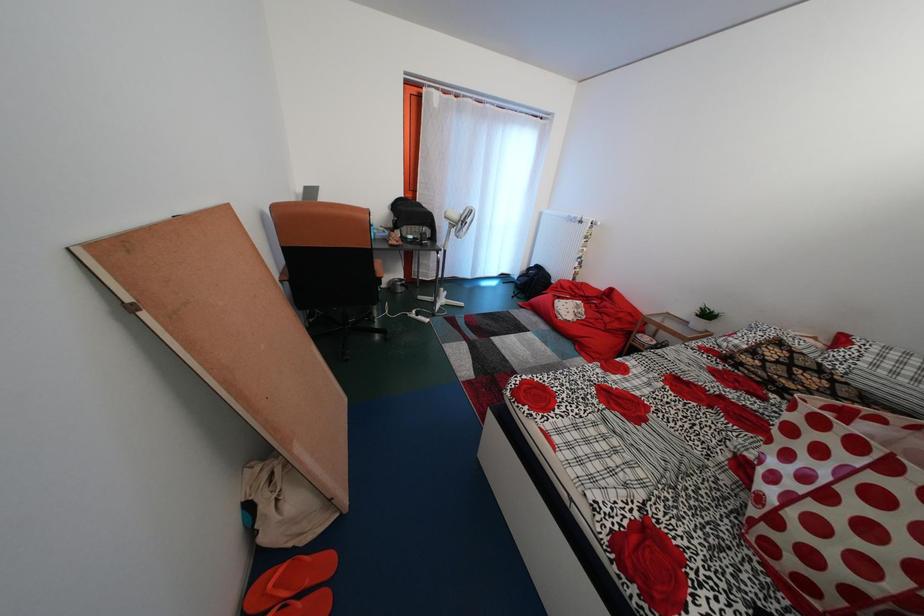
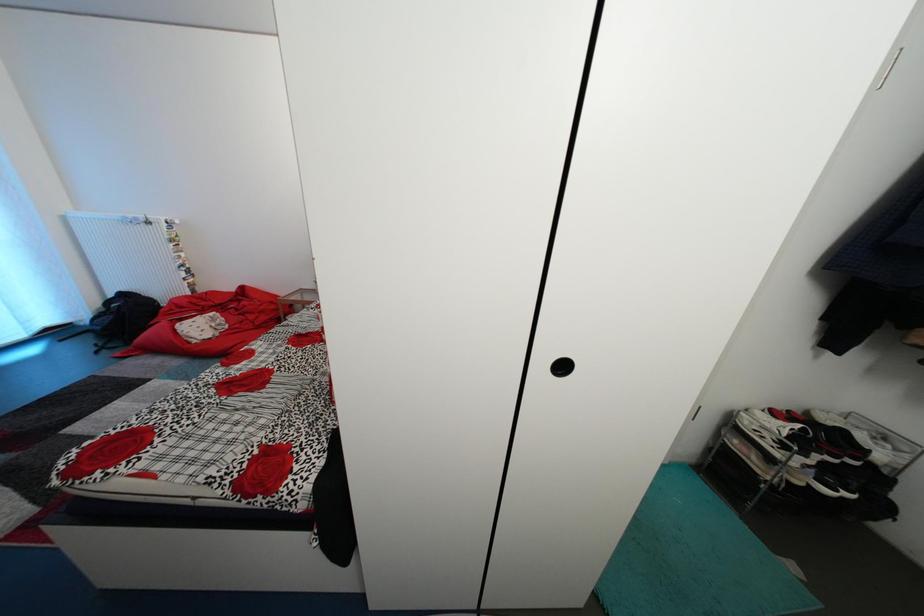
How did the camera likely rotate?

The camera's rotation is toward right-down.